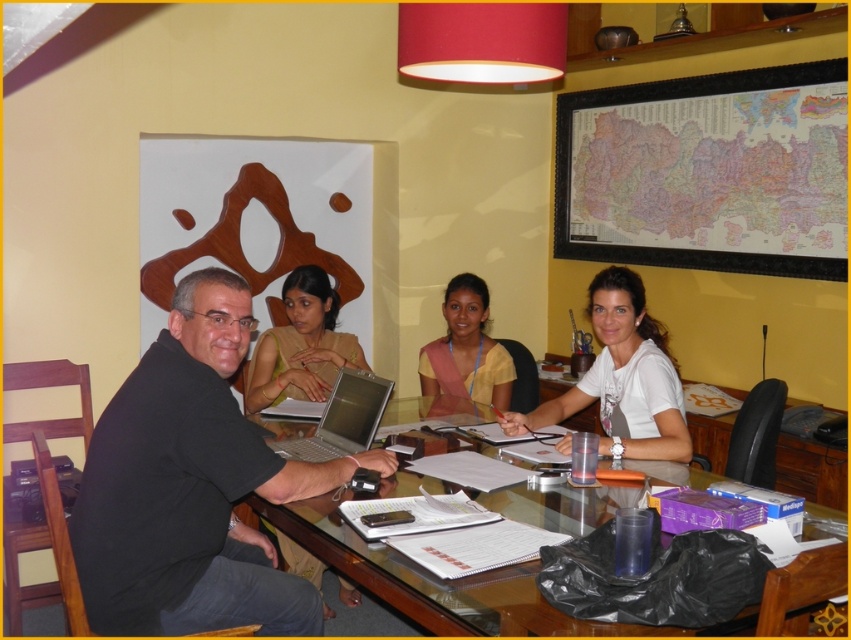
Question: Which of the following is the closest to the observer?

Choices:
 (A) silver metallic laptop at center
 (B) matte yellow blouse at center
 (C) yellow matte shirt at center

Answer: (A)

Question: Which point is closer to the camera taking this photo?

Choices:
 (A) (227, 499)
 (B) (398, 573)
 (C) (629, 324)

Answer: (B)

Question: Estimate the real-world distances between objects in this image. Which object is closer to the matte yellow blouse at center?

Choices:
 (A) black matte shirt at center
 (B) transparent glass table at center

Answer: (B)

Question: Is white matte shirt at center wider than silver metallic laptop at center?

Choices:
 (A) yes
 (B) no

Answer: (A)

Question: Is black matte shirt at center positioned behind matte yellow blouse at center?

Choices:
 (A) no
 (B) yes

Answer: (A)

Question: Does black matte shirt at center appear on the right side of transparent glass table at center?

Choices:
 (A) yes
 (B) no

Answer: (B)